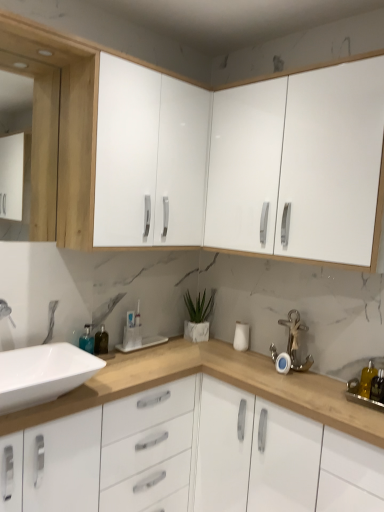
Question: Does silver metallic anchor at lower right turn towards translucent amber bottle at lower left?

Choices:
 (A) no
 (B) yes

Answer: (A)

Question: Can you confirm if silver metallic anchor at lower right is shorter than translucent amber bottle at lower left?

Choices:
 (A) yes
 (B) no

Answer: (B)

Question: Would you say silver metallic anchor at lower right is outside translucent amber bottle at lower left?

Choices:
 (A) no
 (B) yes

Answer: (B)

Question: From a real-world perspective, is silver metallic anchor at lower right on top of translucent amber bottle at lower left?

Choices:
 (A) yes
 (B) no

Answer: (A)

Question: Is silver metallic anchor at lower right touching translucent amber bottle at lower left?

Choices:
 (A) yes
 (B) no

Answer: (B)

Question: Is silver metallic anchor at lower right facing away from translucent amber bottle at lower left?

Choices:
 (A) no
 (B) yes

Answer: (A)

Question: Can you confirm if yellow translucent soap dispenser at right is positioned to the right of white glossy cabinet at center, acting as the third cabinetry starting from the top?

Choices:
 (A) no
 (B) yes

Answer: (B)

Question: Does yellow translucent soap dispenser at right have a lesser height compared to white glossy cabinet at center, the 1th cabinetry in the bottom-to-top sequence?

Choices:
 (A) no
 (B) yes

Answer: (B)

Question: Can you confirm if yellow translucent soap dispenser at right is positioned to the left of white glossy cabinet at center, acting as the third cabinetry starting from the top?

Choices:
 (A) yes
 (B) no

Answer: (B)

Question: Is yellow translucent soap dispenser at right thinner than white glossy cabinet at center, the 1th cabinetry in the bottom-to-top sequence?

Choices:
 (A) no
 (B) yes

Answer: (B)

Question: Is yellow translucent soap dispenser at right positioned far away from white glossy cabinet at center, the 1th cabinetry in the bottom-to-top sequence?

Choices:
 (A) no
 (B) yes

Answer: (A)

Question: Is yellow translucent soap dispenser at right directly adjacent to white glossy cabinet at center, the 1th cabinetry in the bottom-to-top sequence?

Choices:
 (A) yes
 (B) no

Answer: (B)

Question: Does white glossy sink at lower left lie in front of silver metallic anchor at lower right?

Choices:
 (A) yes
 (B) no

Answer: (A)